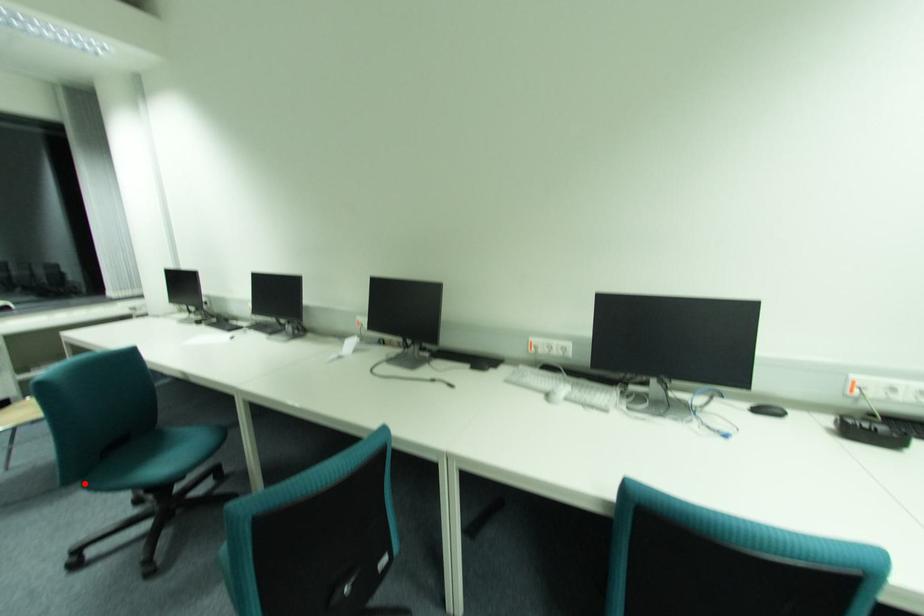
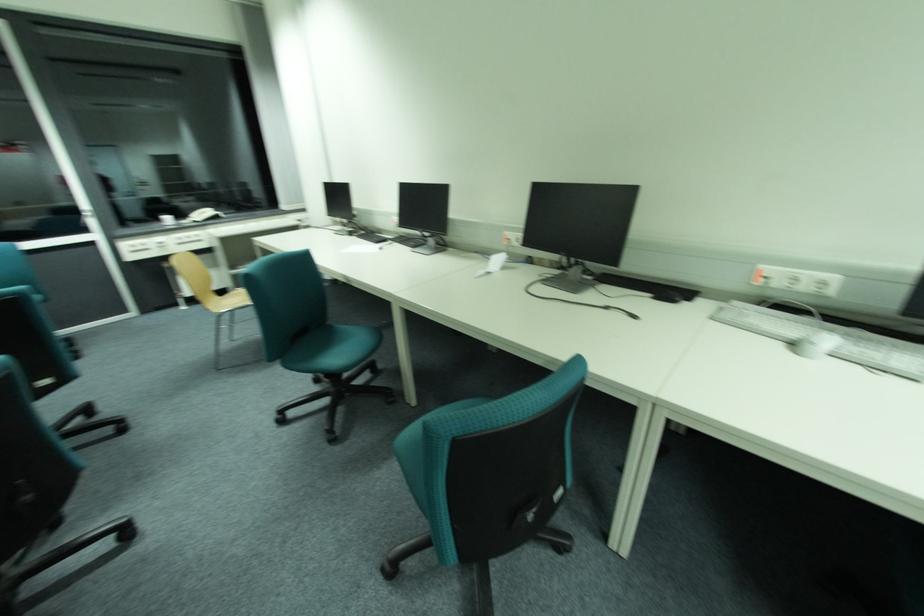
Question: I am providing you with two images of the same scene from different viewpoints. A red point is shown in image1. For the corresponding object point in image2, is it positioned nearer or farther from the camera?

Choices:
 (A) Nearer
 (B) Farther

Answer: (B)